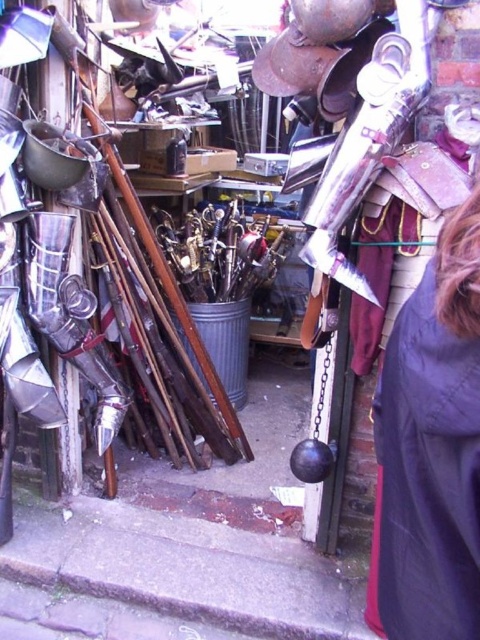
From the picture: Does dark gray fabric cape at lower right appear on the right side of metallic sheen sword at center?

Correct, you'll find dark gray fabric cape at lower right to the right of metallic sheen sword at center.

Can you confirm if dark gray fabric cape at lower right is positioned above metallic sheen sword at center?

Actually, dark gray fabric cape at lower right is below metallic sheen sword at center.

Find the location of a particular element. dark gray fabric cape at lower right is located at coordinates (432, 445).